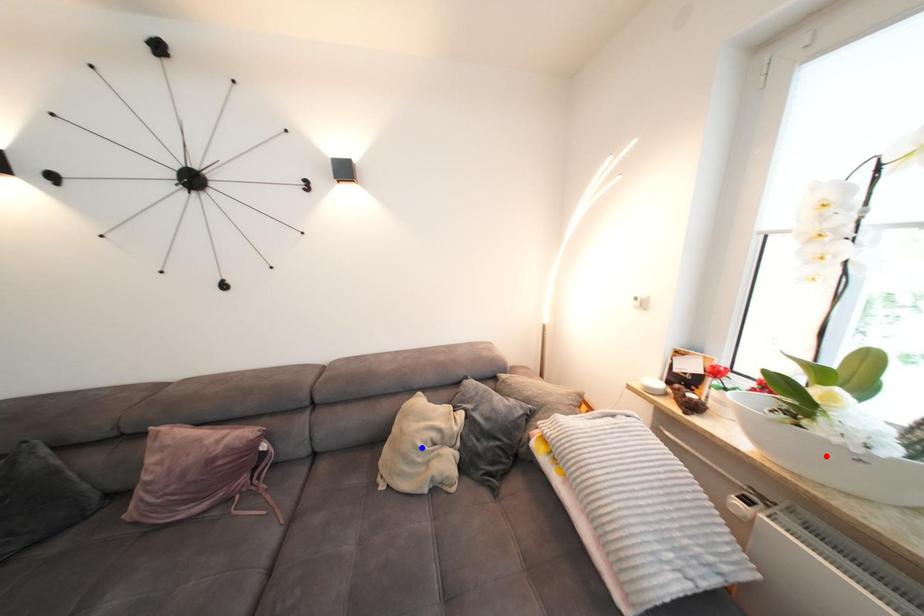
Question: In the image, two points are highlighted. Which point is nearer to the camera? Reply with the corresponding letter.

Choices:
 (A) blue point
 (B) red point

Answer: (B)